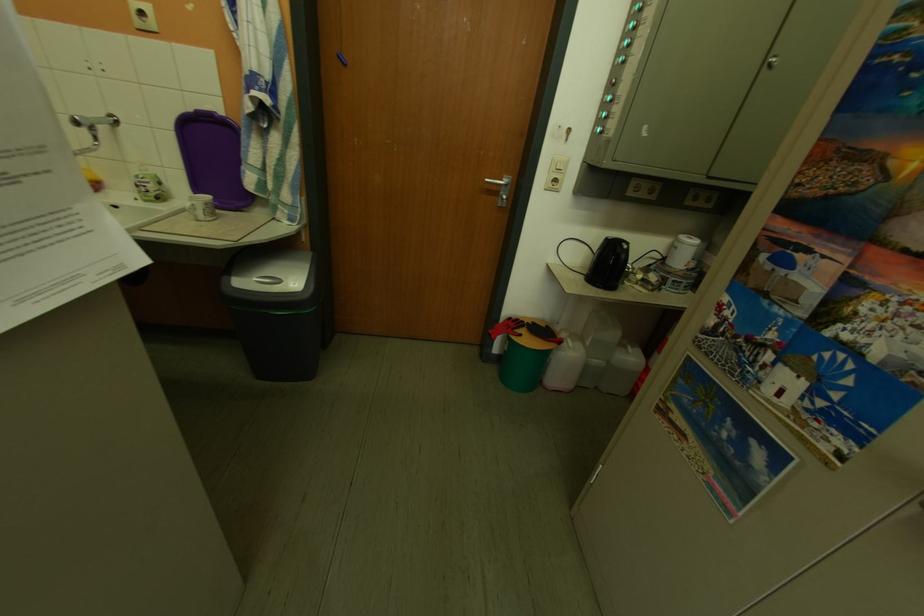
Where would you lift the white mug handle? Please return your answer as a coordinate pair (x, y).

(202, 207)